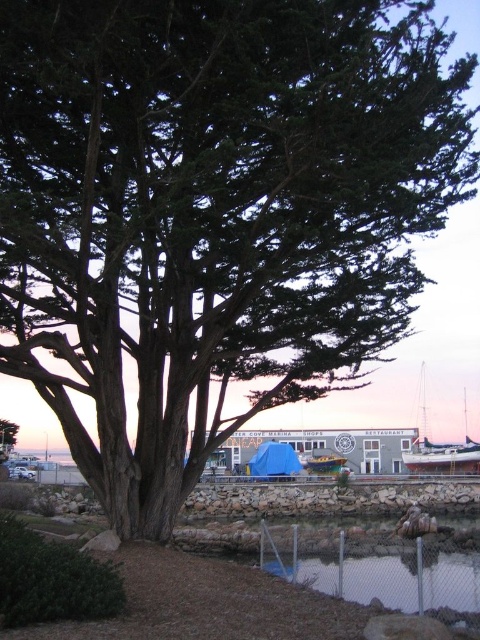
Question: Which of these objects is positioned farthest from the green plastic boat at center?

Choices:
 (A) white glossy sailboat at center
 (B) clear water at lower center
 (C) green rough bark tree at center

Answer: (B)

Question: Among these points, which one is nearest to the camera?

Choices:
 (A) [320, 456]
 (B) [2, 435]
 (C) [420, 384]

Answer: (A)

Question: Does clear water at lower center have a greater width compared to green rough bark tree at center?

Choices:
 (A) no
 (B) yes

Answer: (A)

Question: Is green plastic boat at center closer to camera compared to green rough bark tree at center?

Choices:
 (A) yes
 (B) no

Answer: (A)

Question: Estimate the real-world distances between objects in this image. Which object is closer to the green plastic boat at center?

Choices:
 (A) clear water at lower center
 (B) white glossy boat at lower right
 (C) green rough bark tree at center
 (D) white glossy sailboat at center

Answer: (B)

Question: Where is white glossy boat at lower right located in relation to green plastic boat at center in the image?

Choices:
 (A) below
 (B) above

Answer: (B)